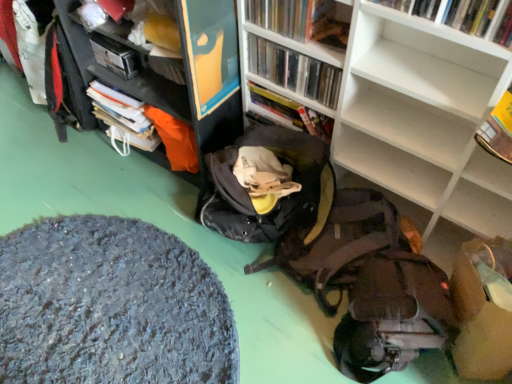
Identify the location of clear plastic case at upper center, positioned as the 3th book in front-to-back order. Image resolution: width=512 pixels, height=384 pixels. click(x=294, y=71).

Based on the photo, measure the distance between point (464, 124) and camera.

A distance of 3.63 feet exists between point (464, 124) and camera.

The image size is (512, 384). What do you see at coordinates (110, 306) in the screenshot?
I see `textured gray rug at lower left` at bounding box center [110, 306].

This screenshot has width=512, height=384. In order to click on matte plastic book at upper center, marked as the 3th book in a back-to-front arrangement in this screenshot , I will do `click(300, 20)`.

This screenshot has width=512, height=384. I want to click on clear plastic case at upper center, arranged as the second book when viewed from the back, so click(294, 71).

Between textured gray rug at lower left and hardcover book at upper right, marked as the 4th book in a back-to-front arrangement, which one appears on the right side from the viewer's perspective?

From the viewer's perspective, hardcover book at upper right, marked as the 4th book in a back-to-front arrangement, appears more on the right side.

Is textured gray rug at lower left not near hardcover book at upper right, marked as the 4th book in a back-to-front arrangement?

That's right, there is a large distance between textured gray rug at lower left and hardcover book at upper right, marked as the 4th book in a back-to-front arrangement.

Is matte brown backpack at lower right to the left or to the right of clear plastic case at upper center, positioned as the 3th book in front-to-back order, in the image?

matte brown backpack at lower right is to the right of clear plastic case at upper center, positioned as the 3th book in front-to-back order.

Looking at this image, is matte brown backpack at lower right positioned far away from clear plastic case at upper center, positioned as the 3th book in front-to-back order?

matte brown backpack at lower right is actually quite close to clear plastic case at upper center, positioned as the 3th book in front-to-back order.

Is matte brown backpack at lower right aimed at clear plastic case at upper center, positioned as the 3th book in front-to-back order?

No, matte brown backpack at lower right is not aimed at clear plastic case at upper center, positioned as the 3th book in front-to-back order.

Considering the sizes of objects matte brown backpack at lower right and clear plastic case at upper center, positioned as the 3th book in front-to-back order, in the image provided, who is shorter, matte brown backpack at lower right or clear plastic case at upper center, positioned as the 3th book in front-to-back order,?

clear plastic case at upper center, positioned as the 3th book in front-to-back order.

Could you tell me if hardcover book at center, which appears as the 4th book when viewed from the front, is turned towards matte plastic book at upper center, arranged as the 2th book when viewed from the front?

No, hardcover book at center, which appears as the 4th book when viewed from the front, is not oriented towards matte plastic book at upper center, arranged as the 2th book when viewed from the front.

Between hardcover book at center, which appears as the 4th book when viewed from the front, and matte plastic book at upper center, arranged as the 2th book when viewed from the front, which one is positioned behind?

hardcover book at center, which appears as the 4th book when viewed from the front.

Is hardcover book at center, which appears as the 4th book when viewed from the front, smaller than matte plastic book at upper center, arranged as the 2th book when viewed from the front?

No, hardcover book at center, which appears as the 4th book when viewed from the front, is not smaller than matte plastic book at upper center, arranged as the 2th book when viewed from the front.

Is point (277, 105) positioned after point (318, 3)?

Yes, point (277, 105) is farther from viewer.

In the scene shown: How many degrees apart are the facing directions of white matte bookcase at center and clear plastic case at upper center, positioned as the 3th book in front-to-back order?

There is a 0.00134-degree angle between the facing directions of white matte bookcase at center and clear plastic case at upper center, positioned as the 3th book in front-to-back order.

Consider the image. From a real-world perspective, which object rests below the other?

white matte bookcase at center, from a real-world perspective.

Does white matte bookcase at center lie behind clear plastic case at upper center, arranged as the second book when viewed from the back?

No, white matte bookcase at center is closer to the viewer.

Does point (480, 196) come closer to viewer compared to point (328, 94)?

Yes, it is.

Considering the positions of point (252, 5) and point (374, 331), is point (252, 5) closer or farther from the camera than point (374, 331)?

Point (252, 5) is positioned farther from the camera compared to point (374, 331).

Which object is positioned more to the left, matte plastic book at upper center, arranged as the 2th book when viewed from the front, or matte brown backpack at lower right?

Positioned to the left is matte plastic book at upper center, arranged as the 2th book when viewed from the front.

Is matte plastic book at upper center, arranged as the 2th book when viewed from the front, closer to camera compared to matte brown backpack at lower right?

No, matte plastic book at upper center, arranged as the 2th book when viewed from the front, is further to the viewer.

Is matte brown backpack at lower right at the back of matte plastic book at upper center, marked as the 3th book in a back-to-front arrangement?

matte plastic book at upper center, marked as the 3th book in a back-to-front arrangement, does not have its back to matte brown backpack at lower right.

This screenshot has height=384, width=512. I want to click on cabinetry located underneath the hardcover book at upper left (from a real-world perspective), so click(x=156, y=89).

From the image's perspective, is hardcover book at upper left under matte black cabinet at upper left?

No, from the image's perspective, hardcover book at upper left is not below matte black cabinet at upper left.

Is hardcover book at upper left closer to the viewer compared to matte black cabinet at upper left?

No, hardcover book at upper left is further to the viewer.

Is hardcover book at upper left not inside matte black cabinet at upper left?

No, hardcover book at upper left is not outside of matte black cabinet at upper left.

Between clear plastic case at upper center, arranged as the second book when viewed from the back, and matte black cabinet at upper left, which one has less height?

clear plastic case at upper center, arranged as the second book when viewed from the back.

From a real-world perspective, which is physically above, clear plastic case at upper center, arranged as the second book when viewed from the back, or matte black cabinet at upper left?

clear plastic case at upper center, arranged as the second book when viewed from the back, from a real-world perspective.

The width and height of the screenshot is (512, 384). What are the coordinates of `wide located below the hardcover book at upper right, marked as the 4th book in a back-to-front arrangement (from the image's perspective)` in the screenshot? It's located at (110, 306).

The image size is (512, 384). I want to click on the 2nd book above the matte brown backpack at lower right (from the image's perspective), so click(x=294, y=71).

In the scene shown: Which object lies further to the anchor point hardcover book at upper left, matte brown backpack at lower right or textured gray rug at lower left?

matte brown backpack at lower right.

Based on their spatial positions, is matte plastic book at upper center, arranged as the 2th book when viewed from the front, or clear plastic case at upper center, arranged as the second book when viewed from the back, further from matte black cabinet at upper left?

Among the two, matte plastic book at upper center, arranged as the 2th book when viewed from the front, is located further to matte black cabinet at upper left.

From the image, which object appears to be nearer to hardcover book at center, which appears as the 4th book when viewed from the front, matte plastic book at upper center, marked as the 3th book in a back-to-front arrangement, or white matte bookcase at center?

Among the two, white matte bookcase at center is located nearer to hardcover book at center, which appears as the 4th book when viewed from the front.

Considering their positions, is matte plastic book at upper center, arranged as the 2th book when viewed from the front, positioned closer to white matte bookcase at center than matte black cabinet at upper left?

matte plastic book at upper center, arranged as the 2th book when viewed from the front, is positioned closer to the anchor white matte bookcase at center.

Considering their positions, is clear plastic case at upper center, positioned as the 3th book in front-to-back order, positioned further to matte plastic book at upper center, arranged as the 2th book when viewed from the front, than matte brown backpack at lower right?

The object further to matte plastic book at upper center, arranged as the 2th book when viewed from the front, is matte brown backpack at lower right.

From the image, which object appears to be nearer to dark gray fabric bean bag chair at center, white matte bookcase at center or hardcover book at upper left?

The object closer to dark gray fabric bean bag chair at center is white matte bookcase at center.

From the image, which object appears to be farther from matte plastic book at upper center, marked as the 3th book in a back-to-front arrangement, white matte bookcase at center or hardcover book at upper right, the 1th book when ordered from front to back?

hardcover book at upper right, the 1th book when ordered from front to back, is further to matte plastic book at upper center, marked as the 3th book in a back-to-front arrangement.

Based on their spatial positions, is hardcover book at upper right, marked as the 4th book in a back-to-front arrangement, or matte black cabinet at upper left further from hardcover book at center, arranged as the first book when viewed from the back?

hardcover book at upper right, marked as the 4th book in a back-to-front arrangement.

At what (x,y) coordinates should I click in order to perform the action: click on book positioned between white matte bookcase at center and matte plastic book at upper center, marked as the 3th book in a back-to-front arrangement, from near to far. Please return your answer as a coordinate pair (x, y). The width and height of the screenshot is (512, 384). Looking at the image, I should click on (470, 16).

The image size is (512, 384). Find the location of `backpack that lies between clear plastic case at upper center, positioned as the 3th book in front-to-back order, and textured gray rug at lower left from top to bottom`. backpack that lies between clear plastic case at upper center, positioned as the 3th book in front-to-back order, and textured gray rug at lower left from top to bottom is located at coordinates (370, 285).

This screenshot has height=384, width=512. I want to click on book between hardcover book at upper left and hardcover book at center, which appears as the 4th book when viewed from the front, from left to right, so click(300, 20).

Locate an element on the screen. This screenshot has height=384, width=512. wide between hardcover book at upper left and white matte bookcase at center from left to right is located at coordinates (110, 306).